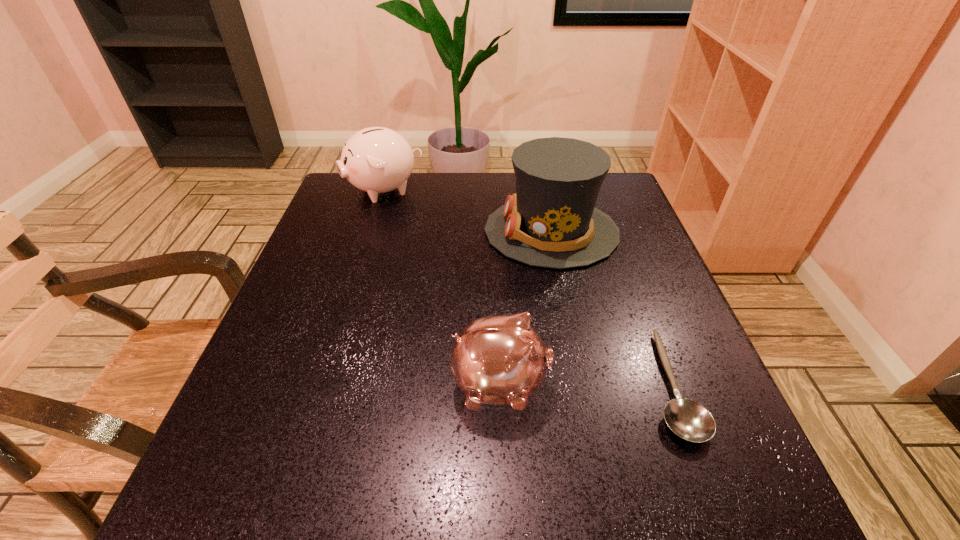
I want to click on free point located 0.240m on the front facing side of the nearer piggy bank, so click(689, 385).

Where is `free region located on the left of the ladle`? free region located on the left of the ladle is located at coordinates (448, 385).

What are the coordinates of `dress hat that is at the far edge` in the screenshot? It's located at (551, 221).

This screenshot has width=960, height=540. Identify the location of piggy bank that is at the far edge. pyautogui.click(x=376, y=160).

Identify the location of object present at the left edge. (376, 160).

The image size is (960, 540). Identify the location of dress hat situated at the right edge. (551, 221).

Find the location of a particular element. ladle that is at the right edge is located at coordinates click(x=688, y=419).

At what (x,y) coordinates should I click in order to perform the action: click on object positioned at the far left corner. Please return your answer as a coordinate pair (x, y). The width and height of the screenshot is (960, 540). Looking at the image, I should click on (376, 160).

The image size is (960, 540). I want to click on object at the far right corner, so click(551, 221).

Image resolution: width=960 pixels, height=540 pixels. Find the location of `vacant space at the far edge of the desktop`. vacant space at the far edge of the desktop is located at coordinates (419, 186).